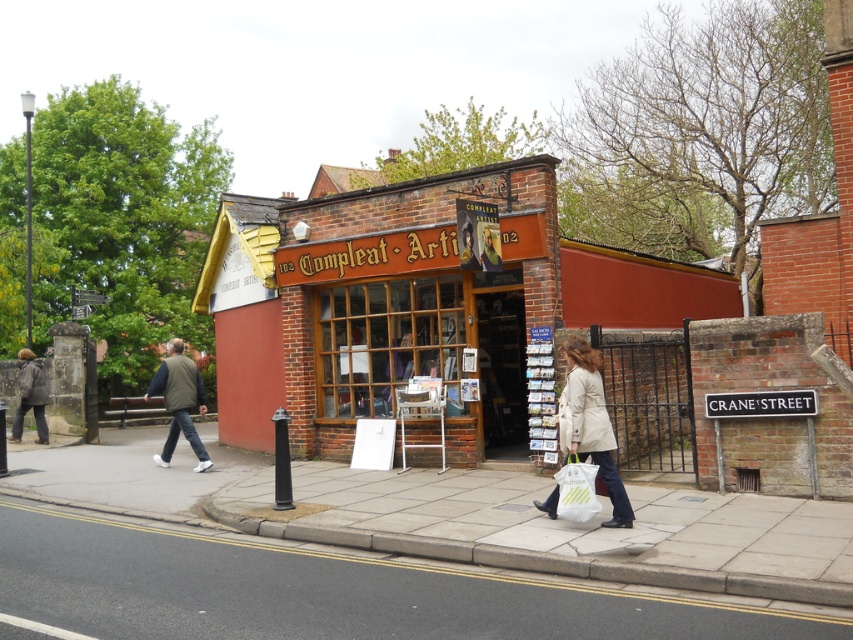
Question: Which point is farther to the camera?

Choices:
 (A) white plastic bag at lower right
 (B) dark gray jacket at lower left

Answer: (B)

Question: Where is light beige coat at lower right located in relation to matte black jacket at center in the image?

Choices:
 (A) above
 (B) below

Answer: (B)

Question: In this image, where is brick storefront at center located relative to white plastic bag at lower right?

Choices:
 (A) right
 (B) left

Answer: (B)

Question: Among these points, which one is farthest from the camera?

Choices:
 (A) (460, 256)
 (B) (560, 483)
 (C) (325, 355)

Answer: (C)

Question: Which point is farther from the camera taking this photo?

Choices:
 (A) (317, 320)
 (B) (187, 390)
 (C) (21, 369)
 (D) (485, 236)

Answer: (C)

Question: Does green fabric jacket at lower left appear under dark gray jacket at lower left?

Choices:
 (A) no
 (B) yes

Answer: (A)